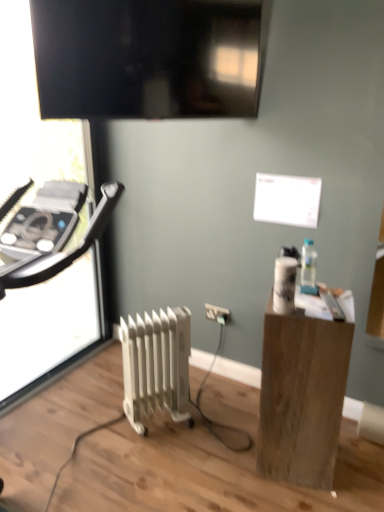
Locate an element on the screen. matte black tv at upper center is located at coordinates (149, 57).

What is the approximate height of matte black tv at upper center?

matte black tv at upper center is 21.08 inches tall.

Where is `transparent glass screen door at left`? Image resolution: width=384 pixels, height=512 pixels. transparent glass screen door at left is located at coordinates (32, 120).

What do you see at coordinates (303, 392) in the screenshot?
I see `wooden block at right` at bounding box center [303, 392].

Identify the location of clear glass bottle at right. The height and width of the screenshot is (512, 384). (308, 268).

Identify the location of white metallic radiator at center. (156, 364).

Consider the image. From the image's perspective, relative to white metallic radiator at center, is transparent glass screen door at left above or below?

transparent glass screen door at left is situated higher than white metallic radiator at center in the image.

In the scene shown: In terms of size, does transparent glass screen door at left appear bigger or smaller than white metallic radiator at center?

Considering their sizes, transparent glass screen door at left takes up more space than white metallic radiator at center.

Which is behind, transparent glass screen door at left or white metallic radiator at center?

Positioned behind is white metallic radiator at center.

From a real-world perspective, does transparent glass screen door at left stand above white metallic radiator at center?

Indeed, from a real-world perspective, transparent glass screen door at left stands above white metallic radiator at center.

Between transparent glass screen door at left and matte black tv at upper center, which one appears on the right side from the viewer's perspective?

matte black tv at upper center.

Which object is thinner, transparent glass screen door at left or matte black tv at upper center?

With smaller width is matte black tv at upper center.

I want to click on television that is on the right side of transparent glass screen door at left, so click(149, 57).

Based on the photo, from the image's perspective, relative to matte black tv at upper center, is white plastic electric outlet at center above or below?

From the image's perspective, white plastic electric outlet at center appears below matte black tv at upper center.

Is white plastic electric outlet at center next to matte black tv at upper center?

No, white plastic electric outlet at center is not making contact with matte black tv at upper center.

This screenshot has height=512, width=384. Find the location of `television above the white plastic electric outlet at center (from a real-world perspective)`. television above the white plastic electric outlet at center (from a real-world perspective) is located at coordinates (149, 57).

Which is behind, point (224, 316) or point (110, 75)?

Point (224, 316)

Considering the relative sizes of wooden block at right and white plastic electric outlet at center in the image provided, is wooden block at right shorter than white plastic electric outlet at center?

No, wooden block at right is not shorter than white plastic electric outlet at center.

How many degrees apart are the facing directions of wooden block at right and white plastic electric outlet at center?

There is a 15.9-degree angle between the facing directions of wooden block at right and white plastic electric outlet at center.

Is wooden block at right facing away from white plastic electric outlet at center?

wooden block at right does not have its back to white plastic electric outlet at center.

From a real-world perspective, between wooden block at right and white plastic electric outlet at center, who is vertically lower?

In real-world perspective, white plastic electric outlet at center is lower.

Between clear glass bottle at right and matte black tv at upper center, which one has smaller width?

matte black tv at upper center is thinner.

The image size is (384, 512). Identify the location of bottle that appears behind the matte black tv at upper center. (308, 268).

Consider the image. From a real-world perspective, is clear glass bottle at right physically located above or below matte black tv at upper center?

From a real-world perspective, clear glass bottle at right is physically below matte black tv at upper center.

Considering the positions of objects clear glass bottle at right and matte black tv at upper center in the image provided, who is more to the right, clear glass bottle at right or matte black tv at upper center?

clear glass bottle at right.

Find the location of a particular element. bottle above the white metallic radiator at center (from a real-world perspective) is located at coordinates (308, 268).

Considering the relative positions of clear glass bottle at right and white metallic radiator at center in the image provided, is clear glass bottle at right behind white metallic radiator at center?

That is False.

Considering the relative sizes of clear glass bottle at right and white metallic radiator at center in the image provided, is clear glass bottle at right thinner than white metallic radiator at center?

Yes.

Is clear glass bottle at right looking in the opposite direction of white metallic radiator at center?

clear glass bottle at right does not have its back to white metallic radiator at center.

Can we say white metallic radiator at center lies outside transparent glass screen door at left?

Indeed, white metallic radiator at center is completely outside transparent glass screen door at left.

Is white metallic radiator at center facing towards transparent glass screen door at left?

No, white metallic radiator at center is not aimed at transparent glass screen door at left.

Would you say white metallic radiator at center is a long distance from transparent glass screen door at left?

Indeed, white metallic radiator at center is not near transparent glass screen door at left.

Is white metallic radiator at center closer to the viewer compared to transparent glass screen door at left?

No, white metallic radiator at center is behind transparent glass screen door at left.

Image resolution: width=384 pixels, height=512 pixels. Identify the location of radiator below the transparent glass screen door at left (from a real-world perspective). (156, 364).

Locate an element on the screen. This screenshot has height=512, width=384. television above the transparent glass screen door at left (from the image's perspective) is located at coordinates (149, 57).

Which object lies further to the anchor point matte black tv at upper center, white plastic electric outlet at center or white metallic radiator at center?

white plastic electric outlet at center.

Considering their positions, is transparent glass screen door at left positioned further to white plastic electric outlet at center than white metallic radiator at center?

transparent glass screen door at left is further to white plastic electric outlet at center.

When comparing their distances from clear glass bottle at right, does white plastic electric outlet at center or wooden block at right seem closer?

wooden block at right is closer to clear glass bottle at right.

In the scene shown: From the image, which object appears to be nearer to transparent glass screen door at left, matte black tv at upper center or white plastic electric outlet at center?

matte black tv at upper center is positioned closer to the anchor transparent glass screen door at left.

When comparing their distances from wooden block at right, does white plastic electric outlet at center or white metallic radiator at center seem closer?

white metallic radiator at center.

Considering their positions, is matte black tv at upper center positioned further to clear glass bottle at right than white plastic electric outlet at center?

matte black tv at upper center.

From the image, which object appears to be farther from matte black tv at upper center, wooden block at right or white metallic radiator at center?

Among the two, wooden block at right is located further to matte black tv at upper center.

Estimate the real-world distances between objects in this image. Which object is closer to transparent glass screen door at left, clear glass bottle at right or wooden block at right?

Among the two, wooden block at right is located nearer to transparent glass screen door at left.

The image size is (384, 512). What are the coordinates of `electric outlet that lies between matte black tv at upper center and wooden block at right from top to bottom` in the screenshot? It's located at (217, 314).

Locate an element on the screen. This screenshot has width=384, height=512. radiator between wooden block at right and white plastic electric outlet at center in the front-back direction is located at coordinates (156, 364).

In order to click on desk between white metallic radiator at center and clear glass bottle at right in this screenshot , I will do `click(303, 392)`.

At what (x,y) coordinates should I click in order to perform the action: click on bottle between matte black tv at upper center and white metallic radiator at center from top to bottom. Please return your answer as a coordinate pair (x, y). The image size is (384, 512). Looking at the image, I should click on (308, 268).